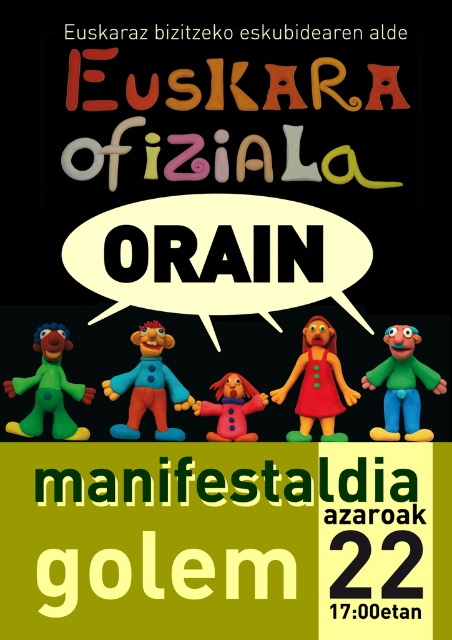
How far apart are green matte clown at center and green clay figure at left?

green matte clown at center is 21.93 meters away from green clay figure at left.

Which is in front, point (378, 376) or point (65, 438)?

Point (378, 376) is in front.

Locate an element on the screen. The height and width of the screenshot is (640, 452). green matte clown at center is located at coordinates (401, 385).

Between point (335, 388) and point (42, 365), which one is positioned in front?

Point (335, 388) is in front.

Does matte plastic doll at center have a larger size compared to green clay figure at left?

Incorrect, matte plastic doll at center is not larger than green clay figure at left.

Is point (338, 406) in front of point (46, 340)?

That is False.

Identify the location of matte plastic doll at center. Image resolution: width=452 pixels, height=640 pixels. (318, 384).

Which is behind, point (320, 316) or point (139, 376)?

The point (320, 316) is more distant.

Describe the element at coordinates (318, 384) in the screenshot. I see `matte plastic doll at center` at that location.

The width and height of the screenshot is (452, 640). What are the coordinates of `matte plastic doll at center` in the screenshot? It's located at (318, 384).